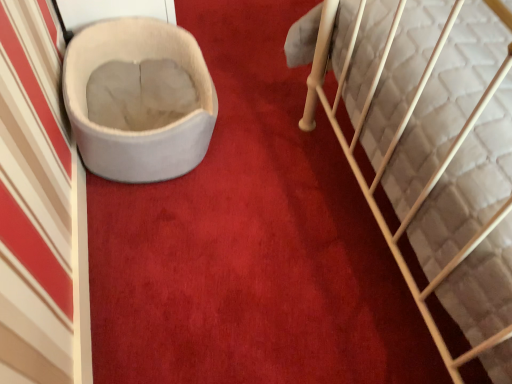
What is the approximate height of white plush cat bed at left?

The height of white plush cat bed at left is 12.09 inches.

What do you see at coordinates (135, 132) in the screenshot?
I see `white plush cat bed at left` at bounding box center [135, 132].

The image size is (512, 384). I want to click on white plush cat bed at left, so click(135, 132).

What is the approximate width of soft gray fabric cat bed at left?

soft gray fabric cat bed at left is 2.38 meters in width.

What do you see at coordinates (396, 149) in the screenshot? I see `soft gray fabric cat bed at left` at bounding box center [396, 149].

Where is `soft gray fabric cat bed at left`? The image size is (512, 384). soft gray fabric cat bed at left is located at coordinates (396, 149).

In order to click on white plush cat bed at left in this screenshot , I will do `click(135, 132)`.

Can you confirm if white plush cat bed at left is positioned to the right of soft gray fabric cat bed at left?

Incorrect, white plush cat bed at left is not on the right side of soft gray fabric cat bed at left.

Is white plush cat bed at left in front of or behind soft gray fabric cat bed at left in the image?

Clearly, white plush cat bed at left is behind soft gray fabric cat bed at left.

Does point (182, 61) appear closer or farther from the camera than point (490, 92)?

Point (182, 61).

From the image's perspective, is white plush cat bed at left below soft gray fabric cat bed at left?

No.

Based on the photo, from a real-world perspective, is white plush cat bed at left under soft gray fabric cat bed at left?

No.

Which of these two, white plush cat bed at left or soft gray fabric cat bed at left, is thinner?

Thinner between the two is white plush cat bed at left.

In terms of height, does white plush cat bed at left look taller or shorter compared to soft gray fabric cat bed at left?

Clearly, white plush cat bed at left is taller compared to soft gray fabric cat bed at left.

Which of these two, white plush cat bed at left or soft gray fabric cat bed at left, is smaller?

white plush cat bed at left.

Do you think white plush cat bed at left is within soft gray fabric cat bed at left, or outside of it?

white plush cat bed at left cannot be found inside soft gray fabric cat bed at left.

Are white plush cat bed at left and soft gray fabric cat bed at left located far from each other?

Actually, white plush cat bed at left and soft gray fabric cat bed at left are a little close together.

Based on the photo, could you tell me if white plush cat bed at left is facing soft gray fabric cat bed at left?

Yes, white plush cat bed at left is oriented towards soft gray fabric cat bed at left.

How different are the orientations of white plush cat bed at left and soft gray fabric cat bed at left in degrees?

A: white plush cat bed at left and soft gray fabric cat bed at left are facing 88.1 degrees away from each other.

How much distance is there between white plush cat bed at left and soft gray fabric cat bed at left?

A distance of 28.43 inches exists between white plush cat bed at left and soft gray fabric cat bed at left.

This screenshot has width=512, height=384. Identify the location of furniture below the white plush cat bed at left (from a real-world perspective). (396, 149).

Which object is positioned more to the left, soft gray fabric cat bed at left or white plush cat bed at left?

white plush cat bed at left is more to the left.

Which is in front, soft gray fabric cat bed at left or white plush cat bed at left?

soft gray fabric cat bed at left is closer to the camera.

Is point (505, 338) positioned after point (152, 166)?

No, (505, 338) is closer to viewer.

From the image's perspective, who appears lower, soft gray fabric cat bed at left or white plush cat bed at left?

soft gray fabric cat bed at left.

From a real-world perspective, which object stands above the other?

white plush cat bed at left, from a real-world perspective.

In terms of width, does soft gray fabric cat bed at left look wider or thinner when compared to white plush cat bed at left?

soft gray fabric cat bed at left is wider than white plush cat bed at left.

Who is taller, soft gray fabric cat bed at left or white plush cat bed at left?

white plush cat bed at left.

Between soft gray fabric cat bed at left and white plush cat bed at left, which one has smaller size?

white plush cat bed at left is smaller.

Is white plush cat bed at left surrounded by soft gray fabric cat bed at left?

No, white plush cat bed at left is not a part of soft gray fabric cat bed at left.

In the scene shown: Does soft gray fabric cat bed at left touch white plush cat bed at left?

No.

Is soft gray fabric cat bed at left oriented towards white plush cat bed at left?

No, soft gray fabric cat bed at left is not turned towards white plush cat bed at left.

Can you tell me how much soft gray fabric cat bed at left and white plush cat bed at left differ in facing direction?

They differ by 88.1 degrees in their facing directions.

Measure the distance between soft gray fabric cat bed at left and white plush cat bed at left.

A distance of 28.43 inches exists between soft gray fabric cat bed at left and white plush cat bed at left.

The image size is (512, 384). I want to click on furniture in front of the white plush cat bed at left, so click(396, 149).

This screenshot has width=512, height=384. I want to click on toilet on the left of soft gray fabric cat bed at left, so click(x=135, y=132).

This screenshot has height=384, width=512. I want to click on toilet behind the soft gray fabric cat bed at left, so click(135, 132).